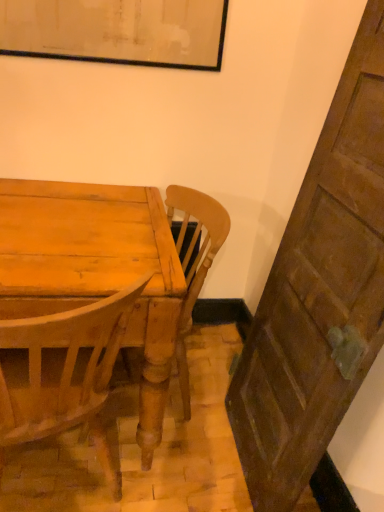
Question: Is wooden chair at center situated inside wooden table top at center or outside?

Choices:
 (A) outside
 (B) inside

Answer: (B)

Question: From the image's perspective, is wooden chair at center positioned above or below wooden table top at center?

Choices:
 (A) below
 (B) above

Answer: (B)

Question: Considering the positions of wooden chair at center and wooden table top at center in the image, is wooden chair at center bigger or smaller than wooden table top at center?

Choices:
 (A) small
 (B) big

Answer: (A)

Question: Considering the relative positions of wooden table top at center and wooden chair at center in the image provided, is wooden table top at center to the left or to the right of wooden chair at center?

Choices:
 (A) left
 (B) right

Answer: (A)

Question: In terms of height, does wooden table top at center look taller or shorter compared to wooden chair at center?

Choices:
 (A) short
 (B) tall

Answer: (A)

Question: Which is correct: wooden table top at center is inside wooden chair at center, or outside of it?

Choices:
 (A) outside
 (B) inside

Answer: (B)

Question: Relative to wooden chair at center, is wooden table top at center in front or behind?

Choices:
 (A) front
 (B) behind

Answer: (A)